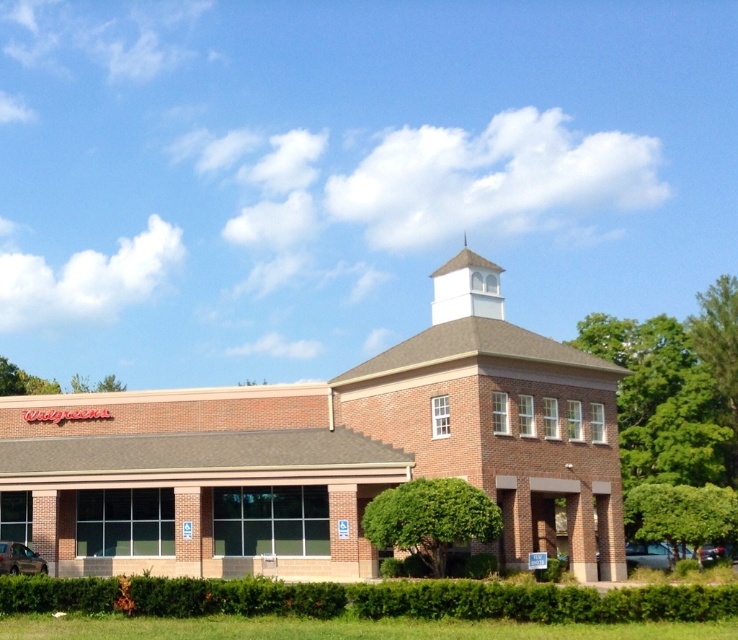
Question: Does brown brick church at center have a lesser width compared to green leafy tree at lower right?

Choices:
 (A) no
 (B) yes

Answer: (A)

Question: Which object appears farthest from the camera in this image?

Choices:
 (A) green leafy tree at center
 (B) green leafy tree at right
 (C) green leafy tree at lower left
 (D) green leafy tree at lower right

Answer: (C)

Question: Among these objects, which one is nearest to the camera?

Choices:
 (A) green leafy tree at lower left
 (B) green leafy tree at right
 (C) green leafy tree at lower right

Answer: (C)

Question: Which point is closer to the camera taking this photo?

Choices:
 (A) (430, 541)
 (B) (593, 333)
 (C) (618, 480)
 (D) (72, 387)

Answer: (A)

Question: Where is brown brick church at center located in relation to green leafy tree at right in the image?

Choices:
 (A) right
 (B) left

Answer: (B)

Question: Is green leafy tree at center in front of green leafy tree at lower right?

Choices:
 (A) no
 (B) yes

Answer: (B)